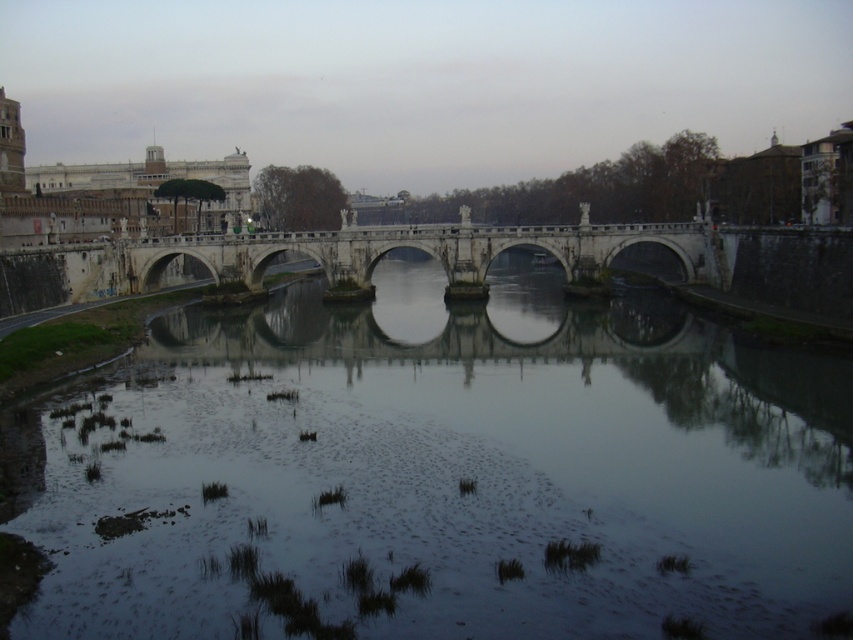
You are an architect analyzing the symmetry of the scene. The dark reflective water at center and the stone bridge at center are both central elements. Which one appears narrower in the image?

The dark reflective water at center is thinner than the stone bridge at center, so it appears narrower in the image.

You are standing at the historic stone bridge and want to reach the point marked at coordinates point (508,570). If your walking speed is 1.2 meters per second, how many seconds will it take you to reach that point?

The point (508,570) is 42.40 meters away from the viewer. At a walking speed of 1.2 meters per second, it would take approximately 35.33 seconds to reach the point.

You are standing on the stone bridge at center and looking down at the dark reflective water at center. Which direction should you move to get closer to the water?

You should move to the right because the dark reflective water at center is located to the right of the stone bridge at center, so moving in that direction will bring you closer to it.